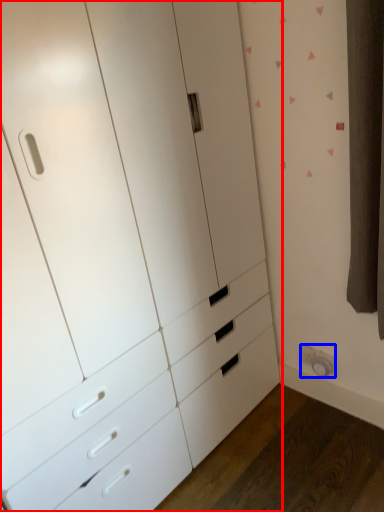
Question: Which object appears farthest to the camera in this image, chest of drawers (highlighted by a red box) or electric outlet (highlighted by a blue box)?

Choices:
 (A) chest of drawers
 (B) electric outlet

Answer: (B)